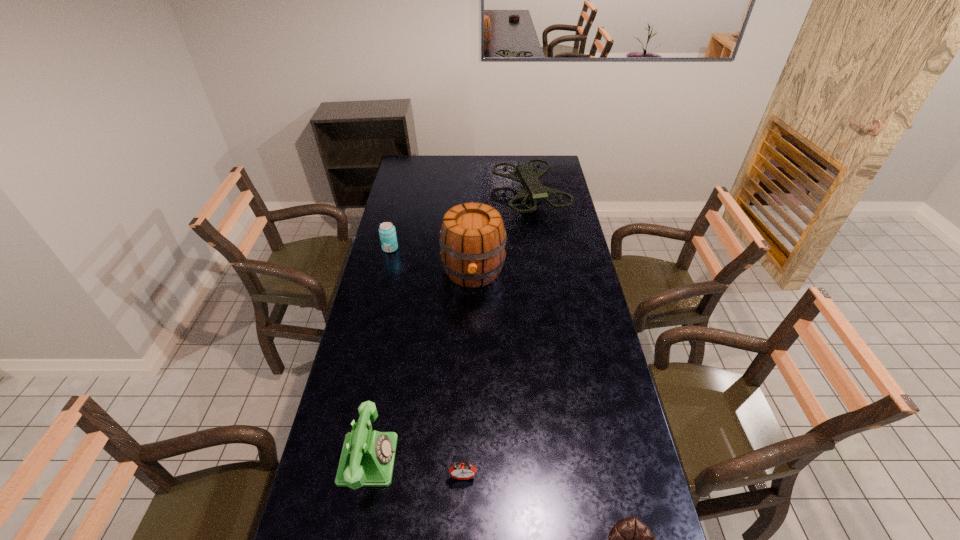
Find the location of a particular element. Image resolution: width=960 pixels, height=540 pixels. object positioned at the far edge is located at coordinates (533, 190).

Find the location of a particular element. The height and width of the screenshot is (540, 960). telephone present at the left edge is located at coordinates (367, 459).

Locate an element on the screen. This screenshot has width=960, height=540. beer can that is at the left edge is located at coordinates (387, 232).

You are a GUI agent. You are given a task and a screenshot of the screen. Output one action in this format:
    pyautogui.click(x=<x>, y=<y>)
    Task: Click on the object that is at the right edge
    This screenshot has width=960, height=540.
    Given the screenshot: What is the action you would take?
    pyautogui.click(x=533, y=190)

Where is `object that is at the far right corner`? object that is at the far right corner is located at coordinates (533, 190).

The height and width of the screenshot is (540, 960). In the image, there is a desktop. In order to click on vacant space at the left edge in this screenshot , I will do `click(340, 415)`.

Locate an element on the screen. vacant space at the right edge of the desktop is located at coordinates (548, 187).

Find the location of a particular element. This screenshot has width=960, height=540. vacant region between the fourth shortest object and the drone is located at coordinates (449, 328).

The height and width of the screenshot is (540, 960). I want to click on vacant space in between the drone and the alarm clock, so click(496, 336).

Where is `free area in between the fourth shortest object and the drone`? Image resolution: width=960 pixels, height=540 pixels. free area in between the fourth shortest object and the drone is located at coordinates (449, 328).